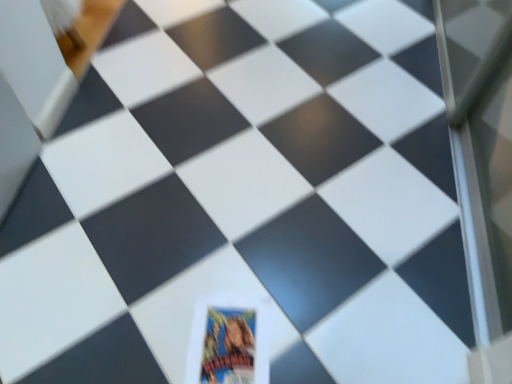
You are a GUI agent. You are given a task and a screenshot of the screen. Output one action in this format:
    pyautogui.click(x=<x>, y=<y>)
    Task: Click on the vacant space to the right of colorful glossy comic book at center
    
    Given the screenshot: What is the action you would take?
    pyautogui.click(x=313, y=329)